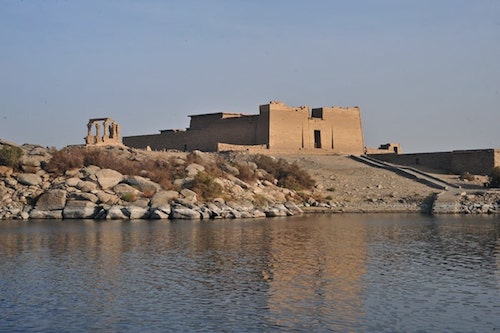
Identify the location of door. (396, 149), (419, 163), (319, 141), (184, 148).